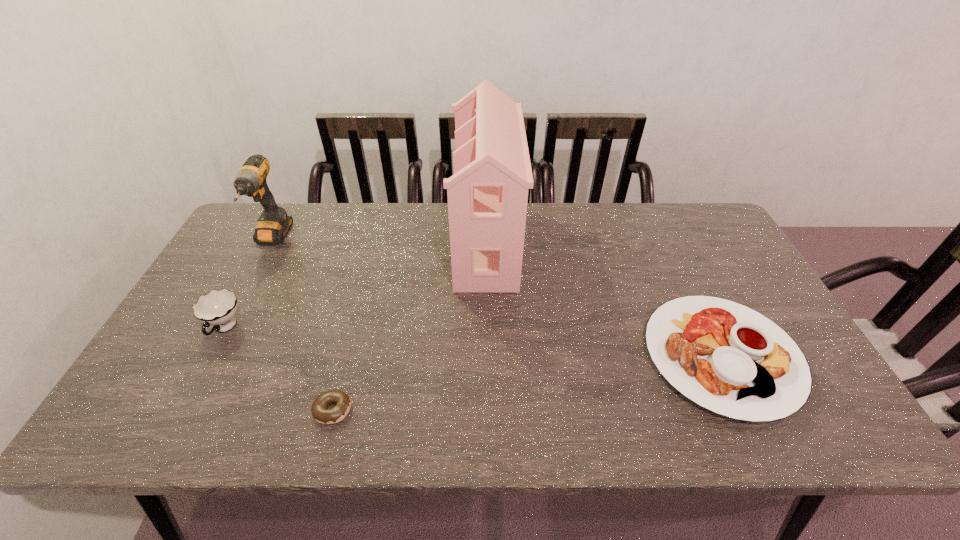
Locate an element on the screen. cup positioned at the left edge is located at coordinates (217, 308).

Where is `object located at the right edge`? object located at the right edge is located at coordinates (726, 357).

At what (x,y) coordinates should I click in order to perform the action: click on object that is positioned at the far left corner. Please return your answer as a coordinate pair (x, y). Looking at the image, I should click on (273, 224).

Image resolution: width=960 pixels, height=540 pixels. What are the coordinates of `object present at the near right corner` in the screenshot? It's located at (726, 357).

The height and width of the screenshot is (540, 960). In order to click on free point at the far edge in this screenshot , I will do `click(605, 211)`.

Image resolution: width=960 pixels, height=540 pixels. I want to click on vacant space at the near edge of the desktop, so click(737, 432).

Identify the location of vacant region at the right edge of the desktop. (732, 301).

At what (x,y) coordinates should I click in order to perform the action: click on free space at the far right corner of the desktop. Please return your answer as a coordinate pair (x, y). The width and height of the screenshot is (960, 540). Looking at the image, I should click on (728, 240).

Image resolution: width=960 pixels, height=540 pixels. In order to click on vacant area that lies between the dollhouse and the platter in this screenshot , I will do `click(604, 300)`.

Find the location of a particular element. The height and width of the screenshot is (540, 960). free area in between the dollhouse and the rightmost object is located at coordinates (604, 300).